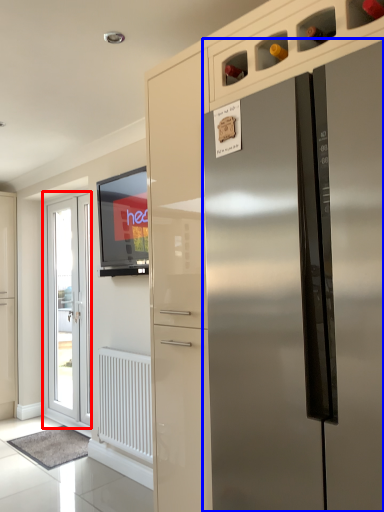
Question: Which object appears closest to the camera in this image, door (highlighted by a red box) or refrigerator (highlighted by a blue box)?

Choices:
 (A) door
 (B) refrigerator

Answer: (B)